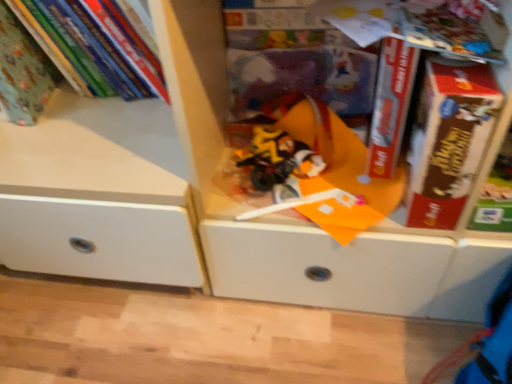
The image size is (512, 384). What do you see at coordinates (391, 106) in the screenshot?
I see `red matte book at center, the 1th paperback book in the left-to-right sequence` at bounding box center [391, 106].

Image resolution: width=512 pixels, height=384 pixels. What are the coordinates of `red matte book at center, the second paperback book viewed from the right` in the screenshot? It's located at [391, 106].

This screenshot has height=384, width=512. Find the location of `matte green book at upper left, arranged as the 2th book when viewed from the left`. matte green book at upper left, arranged as the 2th book when viewed from the left is located at coordinates (x=93, y=47).

Is the surface of matte green book at upper left, arranged as the 2th book when viewed from the left, in direct contact with brown cardboard book at right, placed as the second paperback book when sorted from left to right?

matte green book at upper left, arranged as the 2th book when viewed from the left, is not next to brown cardboard book at right, placed as the second paperback book when sorted from left to right, and they're not touching.

Between matte green book at upper left, which is the 1th book from right to left, and brown cardboard book at right, which is the 1th paperback book in right-to-left order, which one appears on the right side from the viewer's perspective?

Positioned to the right is brown cardboard book at right, which is the 1th paperback book in right-to-left order.

From a real-world perspective, is matte green book at upper left, which is the 1th book from right to left, positioned over brown cardboard book at right, placed as the second paperback book when sorted from left to right, based on gravity?

Yes, from a real-world perspective, matte green book at upper left, which is the 1th book from right to left, is on top of brown cardboard book at right, placed as the second paperback book when sorted from left to right.

Is matte green book at upper left, which is the 1th book from right to left, aimed at brown cardboard book at right, which is the 1th paperback book in right-to-left order?

No, matte green book at upper left, which is the 1th book from right to left, is not turned towards brown cardboard book at right, which is the 1th paperback book in right-to-left order.

Where is `paperback book above the brown cardboard book at right, which is the 1th paperback book in right-to-left order (from a real-world perspective)`? paperback book above the brown cardboard book at right, which is the 1th paperback book in right-to-left order (from a real-world perspective) is located at coordinates (391, 106).

Is red matte book at center, the 1th paperback book in the left-to-right sequence, aimed at brown cardboard book at right, placed as the second paperback book when sorted from left to right?

No, red matte book at center, the 1th paperback book in the left-to-right sequence, is not turned towards brown cardboard book at right, placed as the second paperback book when sorted from left to right.

How many degrees apart are the facing directions of red matte book at center, the second paperback book viewed from the right, and brown cardboard book at right, placed as the second paperback book when sorted from left to right?

1.84 degrees.

Is red matte book at center, the second paperback book viewed from the right, bigger than brown cardboard book at right, which is the 1th paperback book in right-to-left order?

Incorrect, red matte book at center, the second paperback book viewed from the right, is not larger than brown cardboard book at right, which is the 1th paperback book in right-to-left order.

From a real-world perspective, is matte green book at upper left, arranged as the 2th book when viewed from the left, physically below matte green book at upper left, which is counted as the second book, starting from the right?

Correct, in the physical world, matte green book at upper left, arranged as the 2th book when viewed from the left, is lower than matte green book at upper left, which is counted as the second book, starting from the right.

Is matte green book at upper left, which is the 1th book from right to left, to the left or to the right of matte green book at upper left, which is counted as the second book, starting from the right, in the image?

From the image, it's evident that matte green book at upper left, which is the 1th book from right to left, is to the right of matte green book at upper left, which is counted as the second book, starting from the right.

Is matte green book at upper left, which is the 1th book from right to left, in front of matte green book at upper left, which is counted as the second book, starting from the right?

No.

Is matte green book at upper left, arranged as the 2th book when viewed from the left, spatially inside matte green book at upper left, which is counted as the second book, starting from the right, or outside of it?

matte green book at upper left, arranged as the 2th book when viewed from the left, is not inside matte green book at upper left, which is counted as the second book, starting from the right, it's outside.

Which is more to the left, red matte book at center, the 1th paperback book in the left-to-right sequence, or translucent plastic toy at center?

translucent plastic toy at center is more to the left.

Which is behind, red matte book at center, the 1th paperback book in the left-to-right sequence, or translucent plastic toy at center?

translucent plastic toy at center is further away from the camera.

From the picture: Is red matte book at center, the second paperback book viewed from the right, wider or thinner than translucent plastic toy at center?

Clearly, red matte book at center, the second paperback book viewed from the right, has less width compared to translucent plastic toy at center.

Is red matte book at center, the 1th paperback book in the left-to-right sequence, not inside translucent plastic toy at center?

Yes.

From a real-world perspective, is brown cardboard book at right, which is the 1th paperback book in right-to-left order, on top of matte green book at upper left, the first book from the left?

Actually, brown cardboard book at right, which is the 1th paperback book in right-to-left order, is physically below matte green book at upper left, the first book from the left, in the real world.

Considering the sizes of brown cardboard book at right, which is the 1th paperback book in right-to-left order, and matte green book at upper left, the first book from the left, in the image, is brown cardboard book at right, which is the 1th paperback book in right-to-left order, taller or shorter than matte green book at upper left, the first book from the left,?

Considering their sizes, brown cardboard book at right, which is the 1th paperback book in right-to-left order, has less height than matte green book at upper left, the first book from the left.

Does brown cardboard book at right, which is the 1th paperback book in right-to-left order, lie behind matte green book at upper left, the first book from the left?

No.

From the image's perspective, which object appears higher, brown cardboard book at right, which is the 1th paperback book in right-to-left order, or matte green book at upper left, which is counted as the second book, starting from the right?

From the image's view, matte green book at upper left, which is counted as the second book, starting from the right, is above.

Which of these two, red matte book at center, the second paperback book viewed from the right, or matte green book at upper left, arranged as the 2th book when viewed from the left, is thinner?

Thinner between the two is red matte book at center, the second paperback book viewed from the right.

Between red matte book at center, the 1th paperback book in the left-to-right sequence, and matte green book at upper left, which is the 1th book from right to left, which one has smaller size?

Smaller between the two is red matte book at center, the 1th paperback book in the left-to-right sequence.

Is red matte book at center, the 1th paperback book in the left-to-right sequence, touching matte green book at upper left, arranged as the 2th book when viewed from the left?

red matte book at center, the 1th paperback book in the left-to-right sequence, and matte green book at upper left, arranged as the 2th book when viewed from the left, are clearly separated.

From the image's perspective, would you say red matte book at center, the second paperback book viewed from the right, is positioned over matte green book at upper left, arranged as the 2th book when viewed from the left?

Actually, red matte book at center, the second paperback book viewed from the right, appears below matte green book at upper left, arranged as the 2th book when viewed from the left, in the image.

Considering the sizes of objects translucent plastic toy at center and matte green book at upper left, which is counted as the second book, starting from the right, in the image provided, who is smaller, translucent plastic toy at center or matte green book at upper left, which is counted as the second book, starting from the right,?

Smaller between the two is translucent plastic toy at center.

Consider the image. Measure the distance between translucent plastic toy at center and matte green book at upper left, which is counted as the second book, starting from the right.

translucent plastic toy at center and matte green book at upper left, which is counted as the second book, starting from the right, are 18.87 inches apart.

From the image's perspective, is translucent plastic toy at center below matte green book at upper left, which is counted as the second book, starting from the right?

Yes, from the image's perspective, translucent plastic toy at center is beneath matte green book at upper left, which is counted as the second book, starting from the right.

Which object is wider, translucent plastic toy at center or matte green book at upper left, the first book from the left?

Wider between the two is matte green book at upper left, the first book from the left.

From a real-world perspective, count 2nd paperback books downward from the matte green book at upper left, which is the 1th book from right to left, and point to it. Please provide its 2D coordinates.

[(449, 139)]

The width and height of the screenshot is (512, 384). I want to click on paperback book that is above the brown cardboard book at right, which is the 1th paperback book in right-to-left order (from the image's perspective), so click(x=391, y=106).

Based on their spatial positions, is brown cardboard book at right, placed as the second paperback book when sorted from left to right, or matte green book at upper left, arranged as the 2th book when viewed from the left, closer to red matte book at center, the 1th paperback book in the left-to-right sequence?

brown cardboard book at right, placed as the second paperback book when sorted from left to right, is positioned closer to the anchor red matte book at center, the 1th paperback book in the left-to-right sequence.

Considering their positions, is brown cardboard book at right, which is the 1th paperback book in right-to-left order, positioned closer to matte green book at upper left, which is counted as the second book, starting from the right, than matte green book at upper left, arranged as the 2th book when viewed from the left?

matte green book at upper left, arranged as the 2th book when viewed from the left, is positioned closer to the anchor matte green book at upper left, which is counted as the second book, starting from the right.

Estimate the real-world distances between objects in this image. Which object is further from matte green book at upper left, which is the 1th book from right to left, red matte book at center, the 1th paperback book in the left-to-right sequence, or translucent plastic toy at center?

red matte book at center, the 1th paperback book in the left-to-right sequence.

When comparing their distances from brown cardboard book at right, which is the 1th paperback book in right-to-left order, does translucent plastic toy at center or red matte book at center, the second paperback book viewed from the right, seem closer?

red matte book at center, the second paperback book viewed from the right, lies closer to brown cardboard book at right, which is the 1th paperback book in right-to-left order, than the other object.

When comparing their distances from red matte book at center, the second paperback book viewed from the right, does brown cardboard book at right, placed as the second paperback book when sorted from left to right, or matte green book at upper left, which is counted as the second book, starting from the right, seem closer?

brown cardboard book at right, placed as the second paperback book when sorted from left to right.

When comparing their distances from translucent plastic toy at center, does matte green book at upper left, arranged as the 2th book when viewed from the left, or matte green book at upper left, which is counted as the second book, starting from the right, seem further?

The object further to translucent plastic toy at center is matte green book at upper left, which is counted as the second book, starting from the right.

Based on their spatial positions, is translucent plastic toy at center or matte green book at upper left, arranged as the 2th book when viewed from the left, further from matte green book at upper left, which is counted as the second book, starting from the right?

translucent plastic toy at center is further to matte green book at upper left, which is counted as the second book, starting from the right.

Based on their spatial positions, is matte green book at upper left, which is the 1th book from right to left, or red matte book at center, the 1th paperback book in the left-to-right sequence, closer to matte green book at upper left, the first book from the left?

The object closer to matte green book at upper left, the first book from the left, is matte green book at upper left, which is the 1th book from right to left.

The image size is (512, 384). I want to click on paperback book between matte green book at upper left, which is counted as the second book, starting from the right, and brown cardboard book at right, placed as the second paperback book when sorted from left to right, so click(391, 106).

Image resolution: width=512 pixels, height=384 pixels. What are the coordinates of `book between matte green book at upper left, which is counted as the second book, starting from the right, and translucent plastic toy at center` in the screenshot? It's located at (93, 47).

Locate an element on the screen. This screenshot has height=384, width=512. toy situated between matte green book at upper left, which is counted as the second book, starting from the right, and red matte book at center, the 1th paperback book in the left-to-right sequence, from left to right is located at coordinates (276, 159).

I want to click on toy located between matte green book at upper left, which is the 1th book from right to left, and red matte book at center, the 1th paperback book in the left-to-right sequence, in the left-right direction, so click(276, 159).